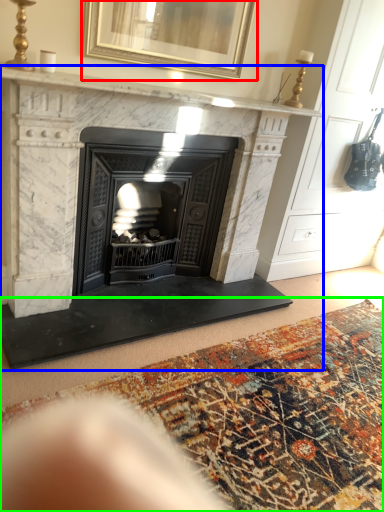
Question: Which object is positioned farthest from picture frame (highlighted by a red box)? Select from fireplace (highlighted by a blue box) and mat (highlighted by a green box).

Choices:
 (A) fireplace
 (B) mat

Answer: (B)